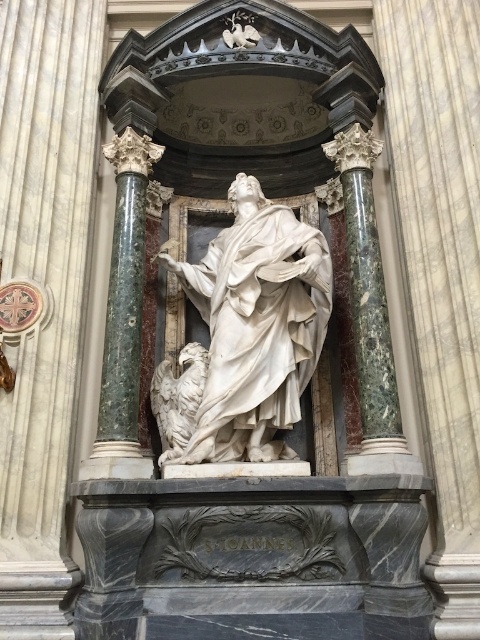
Between green marble column at right and white marble eagle at lower left, which one has less height?

With less height is white marble eagle at lower left.

Can you confirm if green marble column at right is shorter than white marble eagle at lower left?

In fact, green marble column at right may be taller than white marble eagle at lower left.

Does point (370, 160) come closer to viewer compared to point (160, 444)?

No, (370, 160) is behind (160, 444).

Where is `green marble column at right`? green marble column at right is located at coordinates (369, 310).

Consider the image. Who is taller, white marble statue at center or green marble column at right?

With more height is green marble column at right.

Can you confirm if white marble statue at center is taller than green marble column at right?

In fact, white marble statue at center may be shorter than green marble column at right.

The image size is (480, 640). Describe the element at coordinates (254, 326) in the screenshot. I see `white marble statue at center` at that location.

Image resolution: width=480 pixels, height=640 pixels. I want to click on white marble statue at center, so click(x=254, y=326).

Can you confirm if green marble column at left is positioned to the left of green marble column at right?

Yes, green marble column at left is to the left of green marble column at right.

Between green marble column at left and green marble column at right, which one has more height?

With more height is green marble column at right.

Is point (141, 170) less distant than point (357, 349)?

No.

Image resolution: width=480 pixels, height=640 pixels. I want to click on green marble column at left, so click(123, 316).